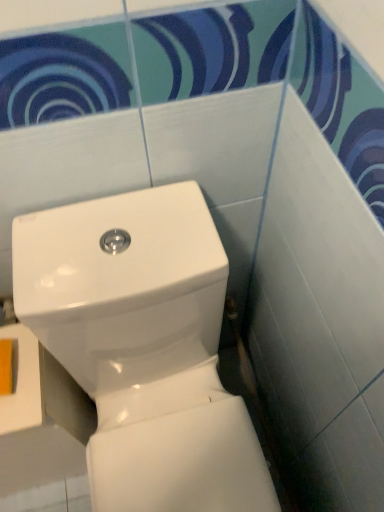
Identify the location of yellow matte toilet paper at lower left. (6, 366).

What do you see at coordinates (6, 366) in the screenshot? I see `yellow matte toilet paper at lower left` at bounding box center [6, 366].

The width and height of the screenshot is (384, 512). What are the coordinates of `white glossy toilet at center` in the screenshot? It's located at (143, 347).

What do you see at coordinates (143, 347) in the screenshot? I see `white glossy toilet at center` at bounding box center [143, 347].

Locate an element on the screen. yellow matte toilet paper at lower left is located at coordinates (6, 366).

Considering the relative positions of white glossy toilet at center and yellow matte toilet paper at lower left in the image provided, is white glossy toilet at center to the right of yellow matte toilet paper at lower left from the viewer's perspective?

Indeed, white glossy toilet at center is positioned on the right side of yellow matte toilet paper at lower left.

Which object is further away from the camera taking this photo, white glossy toilet at center or yellow matte toilet paper at lower left?

yellow matte toilet paper at lower left is behind.

Is point (149, 339) positioned behind point (9, 355)?

That is False.

From the image's perspective, between white glossy toilet at center and yellow matte toilet paper at lower left, who is located below?

white glossy toilet at center appears lower in the image.

From a real-world perspective, is white glossy toilet at center positioned under yellow matte toilet paper at lower left based on gravity?

Yes, from a real-world perspective, white glossy toilet at center is beneath yellow matte toilet paper at lower left.

Does white glossy toilet at center have a greater width compared to yellow matte toilet paper at lower left?

Yes.

Is white glossy toilet at center taller than yellow matte toilet paper at lower left?

Yes, white glossy toilet at center is taller than yellow matte toilet paper at lower left.

From the picture: Is white glossy toilet at center smaller than yellow matte toilet paper at lower left?

Actually, white glossy toilet at center might be larger than yellow matte toilet paper at lower left.

Based on the photo, would you say white glossy toilet at center contains yellow matte toilet paper at lower left?

No.

Is white glossy toilet at center with yellow matte toilet paper at lower left?

No, white glossy toilet at center is not with yellow matte toilet paper at lower left.

Is white glossy toilet at center positioned with its back to yellow matte toilet paper at lower left?

No.

Locate an element on the screen. toilet paper behind the white glossy toilet at center is located at coordinates pyautogui.click(x=6, y=366).

Which is more to the right, yellow matte toilet paper at lower left or white glossy toilet at center?

white glossy toilet at center.

Is yellow matte toilet paper at lower left closer to camera compared to white glossy toilet at center?

No, yellow matte toilet paper at lower left is further to the viewer.

Is point (10, 344) in front of point (196, 508)?

Yes, point (10, 344) is in front of point (196, 508).

From the image's perspective, would you say yellow matte toilet paper at lower left is shown under white glossy toilet at center?

No.

From a real-world perspective, is yellow matte toilet paper at lower left above or below white glossy toilet at center?

In terms of real-world spatial position, yellow matte toilet paper at lower left is above white glossy toilet at center.

Which object is thinner, yellow matte toilet paper at lower left or white glossy toilet at center?

With smaller width is yellow matte toilet paper at lower left.

Considering the relative sizes of yellow matte toilet paper at lower left and white glossy toilet at center in the image provided, is yellow matte toilet paper at lower left taller than white glossy toilet at center?

In fact, yellow matte toilet paper at lower left may be shorter than white glossy toilet at center.

Can you confirm if yellow matte toilet paper at lower left is smaller than white glossy toilet at center?

Yes.

Which is correct: yellow matte toilet paper at lower left is inside white glossy toilet at center, or outside of it?

The correct answer is: outside.

Is yellow matte toilet paper at lower left far away from white glossy toilet at center?

No, yellow matte toilet paper at lower left is not far away from white glossy toilet at center.

Does yellow matte toilet paper at lower left turn towards white glossy toilet at center?

No.

The height and width of the screenshot is (512, 384). Identify the location of toilet paper located above the white glossy toilet at center (from a real-world perspective). (6, 366).

Find the location of `toilet that is in front of the yellow matte toilet paper at lower left`. toilet that is in front of the yellow matte toilet paper at lower left is located at coordinates (143, 347).

Where is `toilet paper to the left of white glossy toilet at center`? The width and height of the screenshot is (384, 512). toilet paper to the left of white glossy toilet at center is located at coordinates (6, 366).